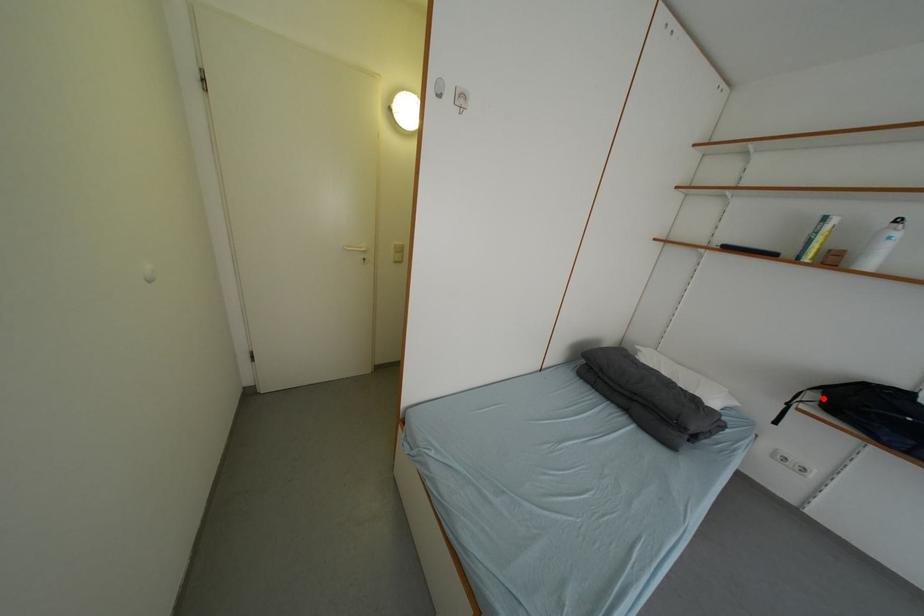
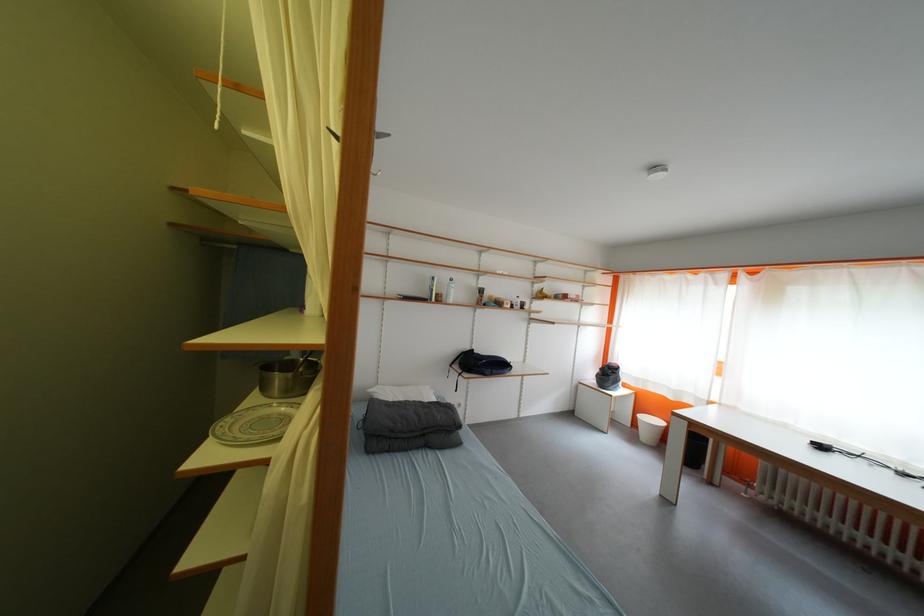
Question: I am providing you with two images of the same scene from different viewpoints. A red point is marked on the first image. At the location where the point appears in image 1, is it still visible in image 2?

Choices:
 (A) Yes
 (B) No

Answer: (A)